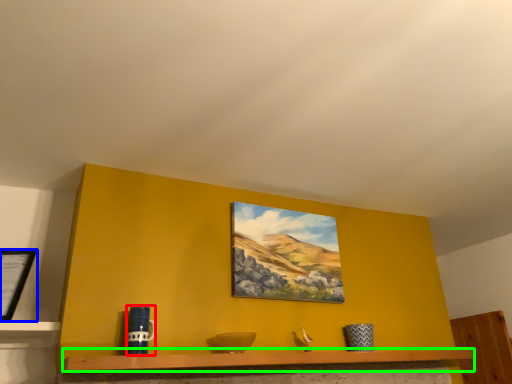
Question: Which object is the farthest from mug (highlighted by a red box)? Choose among these: picture frame (highlighted by a blue box) or shelf (highlighted by a green box).

Choices:
 (A) picture frame
 (B) shelf

Answer: (A)